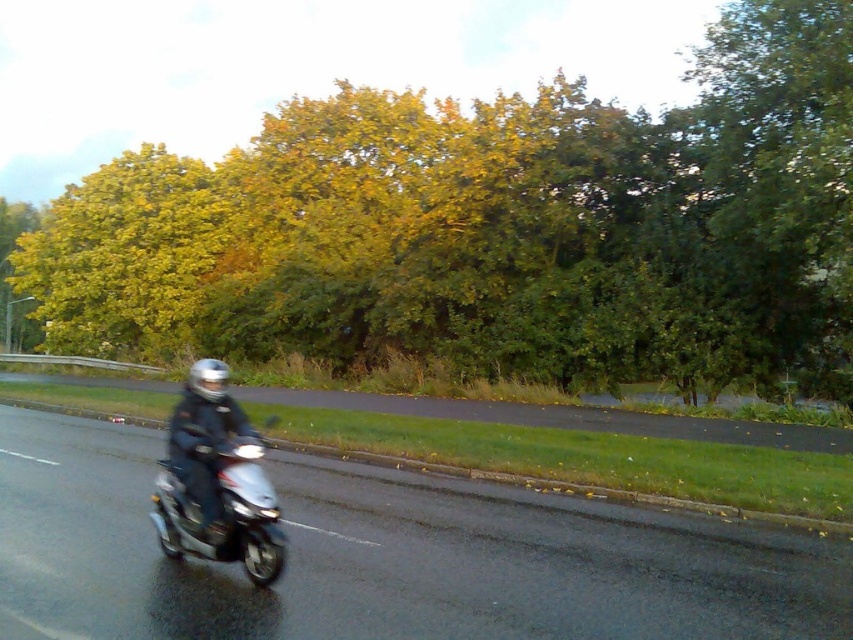
Can you confirm if yellow-green foliage at center is shorter than metallic silver scooter at center?

Incorrect, yellow-green foliage at center's height does not fall short of metallic silver scooter at center's.

Can you confirm if yellow-green foliage at center is positioned above metallic silver scooter at center?

Correct, yellow-green foliage at center is located above metallic silver scooter at center.

Locate an element on the screen. Image resolution: width=853 pixels, height=640 pixels. yellow-green foliage at center is located at coordinates (497, 228).

Identify the location of yellow-green foliage at center. [497, 228].

What do you see at coordinates (497, 228) in the screenshot? The image size is (853, 640). I see `yellow-green foliage at center` at bounding box center [497, 228].

Is yellow-green foliage at center bigger than black leather jacket at center?

Yes.

Identify the location of yellow-green foliage at center. (497, 228).

Is metallic silver scooter at center taller than black leather jacket at center?

In fact, metallic silver scooter at center may be shorter than black leather jacket at center.

Where is `metallic silver scooter at center`? metallic silver scooter at center is located at coordinates (386, 560).

Find the location of a particular element. The image size is (853, 640). metallic silver scooter at center is located at coordinates click(x=386, y=560).